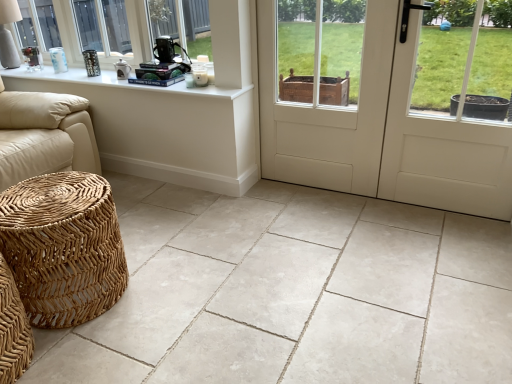
Identify the location of vacant area on the back side of woven natural basket at lower left. (147, 235).